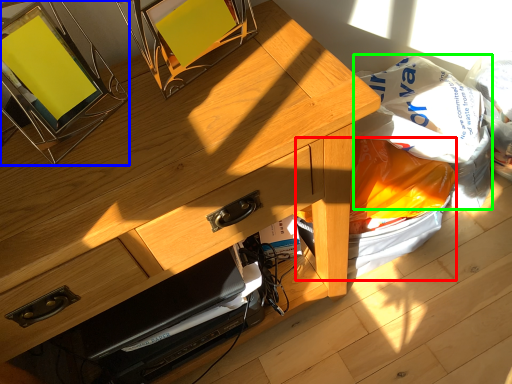
Question: Which object is positioned closest to garbage (highlighted by a red box)? Select from picture frame (highlighted by a blue box) and grocery bag (highlighted by a green box).

Choices:
 (A) picture frame
 (B) grocery bag

Answer: (B)